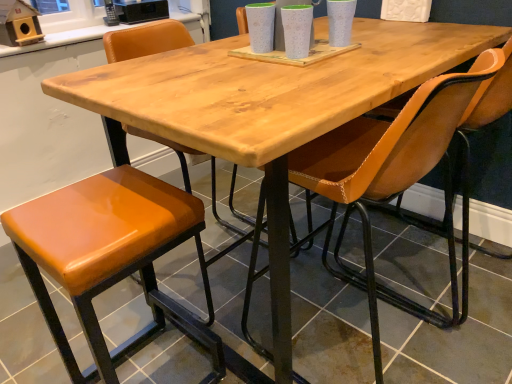
Measure the distance between point [237,17] and camera.

Point [237,17] is 7.66 feet away from camera.

Locate an element on the screen. This screenshot has height=384, width=512. orange leather stool at lower left is located at coordinates (102, 250).

The height and width of the screenshot is (384, 512). Describe the element at coordinates (389, 175) in the screenshot. I see `leatherette chair at center, which ranks as the first chair in front-to-back order` at that location.

This screenshot has width=512, height=384. I want to click on orange leather chair at center, which is counted as the 2th chair, starting from the front, so click(241, 20).

Is orange leather stool at lower left facing towards leatherette chair at center, which is counted as the 1th chair, starting from the bottom?

No, orange leather stool at lower left is not turned towards leatherette chair at center, which is counted as the 1th chair, starting from the bottom.

Can you confirm if orange leather stool at lower left is positioned to the left of leatherette chair at center, which is counted as the 1th chair, starting from the bottom?

Correct, you'll find orange leather stool at lower left to the left of leatherette chair at center, which is counted as the 1th chair, starting from the bottom.

From a real-world perspective, between orange leather stool at lower left and leatherette chair at center, which is the 2th chair in back-to-front order, who is vertically higher?

leatherette chair at center, which is the 2th chair in back-to-front order, from a real-world perspective.

Does orange leather stool at lower left have a larger size compared to leatherette chair at center, which is the 2th chair in back-to-front order?

No.

Which of these two, leatherette chair at center, which ranks as the first chair in front-to-back order, or orange leather stool at lower left, is smaller?

Smaller between the two is orange leather stool at lower left.

Is leatherette chair at center, which ranks as the first chair in front-to-back order, situated inside orange leather stool at lower left or outside?

leatherette chair at center, which ranks as the first chair in front-to-back order, is outside orange leather stool at lower left.

Which point is more distant from viewer, (x=473, y=70) or (x=45, y=242)?

Point (x=45, y=242)

Is point (115, 228) positioned behind point (242, 29)?

That is False.

Measure the distance from orange leather stool at lower left to orange leather chair at center, which is counted as the 2th chair, starting from the front.

orange leather stool at lower left is 39.13 inches away from orange leather chair at center, which is counted as the 2th chair, starting from the front.

Consider the image. From a real-world perspective, between orange leather stool at lower left and orange leather chair at center, which is counted as the 2th chair, starting from the front, who is vertically higher?

In real-world perspective, orange leather chair at center, which is counted as the 2th chair, starting from the front, is above.

Can you confirm if orange leather stool at lower left is wider than orange leather chair at center, which is counted as the 2th chair, starting from the front?

Correct, the width of orange leather stool at lower left exceeds that of orange leather chair at center, which is counted as the 2th chair, starting from the front.

Considering the relative positions of orange leather chair at center, positioned as the first chair in top-to-bottom order, and leatherette chair at center, which ranks as the first chair in front-to-back order, in the image provided, is orange leather chair at center, positioned as the first chair in top-to-bottom order, behind leatherette chair at center, which ranks as the first chair in front-to-back order,?

Yes, orange leather chair at center, positioned as the first chair in top-to-bottom order, is further from the viewer.

Can you tell me how much orange leather chair at center, acting as the second chair starting from the bottom, and leatherette chair at center, the 2th chair positioned from the top, differ in facing direction?

The angle between the facing direction of orange leather chair at center, acting as the second chair starting from the bottom, and the facing direction of leatherette chair at center, the 2th chair positioned from the top, is 91 degrees.

Consider the image. Considering the relative sizes of orange leather chair at center, arranged as the 1th chair when viewed from the back, and leatherette chair at center, which ranks as the first chair in front-to-back order, in the image provided, is orange leather chair at center, arranged as the 1th chair when viewed from the back, shorter than leatherette chair at center, which ranks as the first chair in front-to-back order,?

Yes.

From a real-world perspective, between leatherette chair at center, which is counted as the 1th chair, starting from the bottom, and orange leather chair at center, acting as the second chair starting from the bottom, who is vertically higher?

orange leather chair at center, acting as the second chair starting from the bottom.

From the image's perspective, which is above, leatherette chair at center, which is the 2th chair in back-to-front order, or orange leather chair at center, acting as the second chair starting from the bottom?

From the image's view, orange leather chair at center, acting as the second chair starting from the bottom, is above.

Is point (259, 349) less distant than point (238, 29)?

Yes, it is.

Is orange leather chair at center, positioned as the first chair in top-to-bottom order, positioned in front of orange leather stool at lower left?

That is False.

From the image's perspective, is orange leather chair at center, acting as the second chair starting from the bottom, below orange leather stool at lower left?

No.

Which object is positioned more to the left, orange leather chair at center, which is counted as the 2th chair, starting from the front, or orange leather stool at lower left?

orange leather stool at lower left.

How different are the orientations of orange leather chair at center, positioned as the first chair in top-to-bottom order, and orange leather stool at lower left in degrees?

orange leather chair at center, positioned as the first chair in top-to-bottom order, and orange leather stool at lower left are facing 179 degrees away from each other.

In order to click on chair that is the 1st one above the orange leather stool at lower left (from a real-world perspective) in this screenshot , I will do `click(389, 175)`.

Identify the location of stool below the leatherette chair at center, which is counted as the 1th chair, starting from the bottom (from a real-world perspective). This screenshot has height=384, width=512. (102, 250).

Looking at the image, which one is located closer to orange leather chair at center, which is counted as the 2th chair, starting from the front, leatherette chair at center, which ranks as the first chair in front-to-back order, or orange leather stool at lower left?

leatherette chair at center, which ranks as the first chair in front-to-back order.

In the scene shown: Considering their positions, is orange leather chair at center, acting as the second chair starting from the bottom, positioned further to leatherette chair at center, which ranks as the first chair in front-to-back order, than orange leather stool at lower left?

orange leather chair at center, acting as the second chair starting from the bottom, is positioned further to the anchor leatherette chair at center, which ranks as the first chair in front-to-back order.

Considering their positions, is orange leather stool at lower left positioned closer to orange leather chair at center, which is counted as the 2th chair, starting from the front, than leatherette chair at center, which ranks as the first chair in front-to-back order?

The object closer to orange leather chair at center, which is counted as the 2th chair, starting from the front, is leatherette chair at center, which ranks as the first chair in front-to-back order.

Considering their positions, is orange leather stool at lower left positioned closer to leatherette chair at center, which ranks as the first chair in front-to-back order, than orange leather chair at center, positioned as the first chair in top-to-bottom order?

orange leather stool at lower left is closer to leatherette chair at center, which ranks as the first chair in front-to-back order.

Which object lies nearer to the anchor point orange leather stool at lower left, orange leather chair at center, acting as the second chair starting from the bottom, or leatherette chair at center, which is the 2th chair in back-to-front order?

leatherette chair at center, which is the 2th chair in back-to-front order, is closer to orange leather stool at lower left.

Considering their positions, is leatherette chair at center, which is the 2th chair in back-to-front order, positioned further to orange leather stool at lower left than orange leather chair at center, positioned as the first chair in top-to-bottom order?

Among the two, orange leather chair at center, positioned as the first chair in top-to-bottom order, is located further to orange leather stool at lower left.

Find the location of a particular element. The width and height of the screenshot is (512, 384). chair between orange leather chair at center, arranged as the 1th chair when viewed from the back, and orange leather stool at lower left, in the vertical direction is located at coordinates (389, 175).